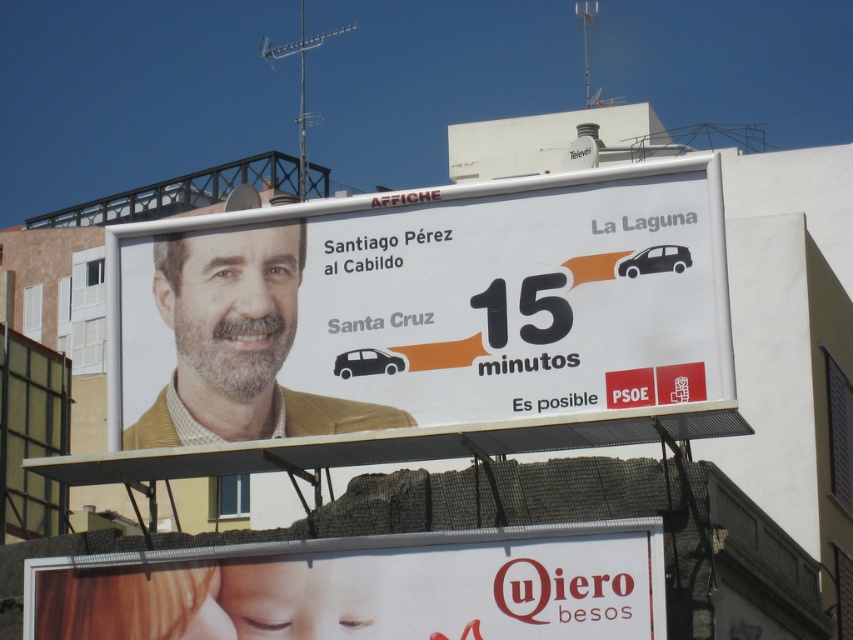
Does white paper billboard at center have a lesser height compared to white paper at lower center?

Incorrect, white paper billboard at center's height does not fall short of white paper at lower center's.

Between point (154, 330) and point (238, 621), which one is positioned in front?

Positioned in front is point (238, 621).

Between point (201, 397) and point (535, 573), which one is positioned in front?

Point (535, 573)

The height and width of the screenshot is (640, 853). I want to click on white paper billboard at center, so click(x=422, y=308).

Which is in front, point (263, 612) or point (206, 346)?

Positioned in front is point (263, 612).

Who is shorter, white paper at lower center or matte yellow jacket at center?

matte yellow jacket at center

Identify the location of white paper at lower center. This screenshot has height=640, width=853. tap(364, 588).

Can you confirm if white paper billboard at center is thinner than matte yellow jacket at center?

No.

The image size is (853, 640). In order to click on white paper billboard at center in this screenshot , I will do `click(422, 308)`.